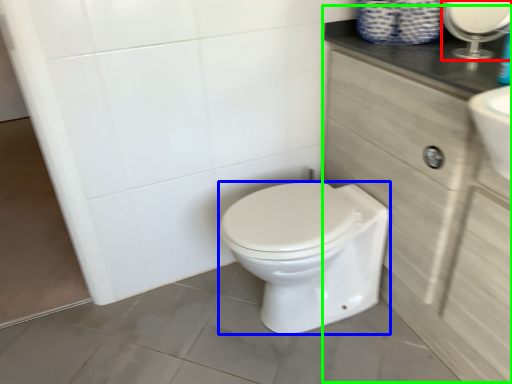
Question: Estimate the real-world distances between objects in this image. Which object is closer to mirror (highlighted by a red box), bidet (highlighted by a blue box) or cabinetry (highlighted by a green box)?

Choices:
 (A) bidet
 (B) cabinetry

Answer: (B)